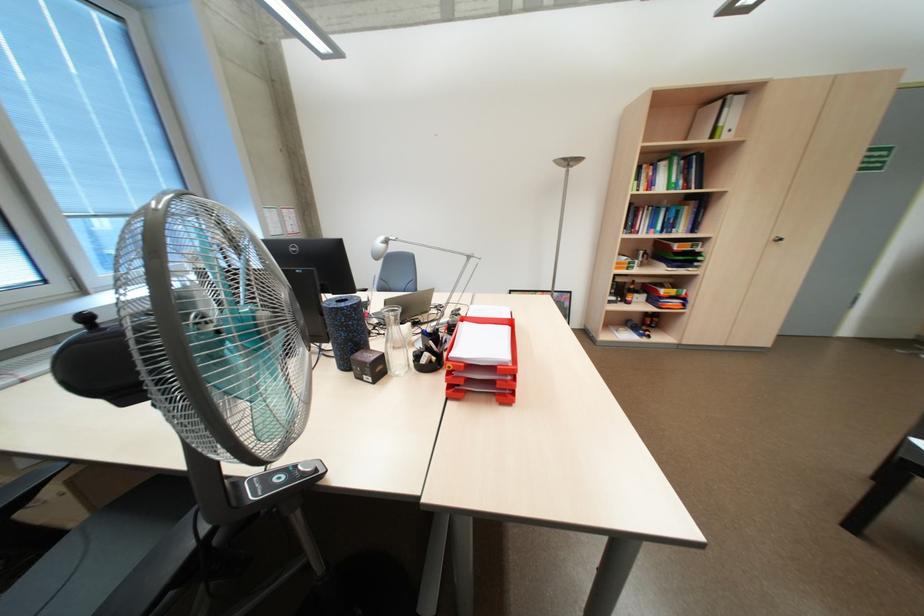
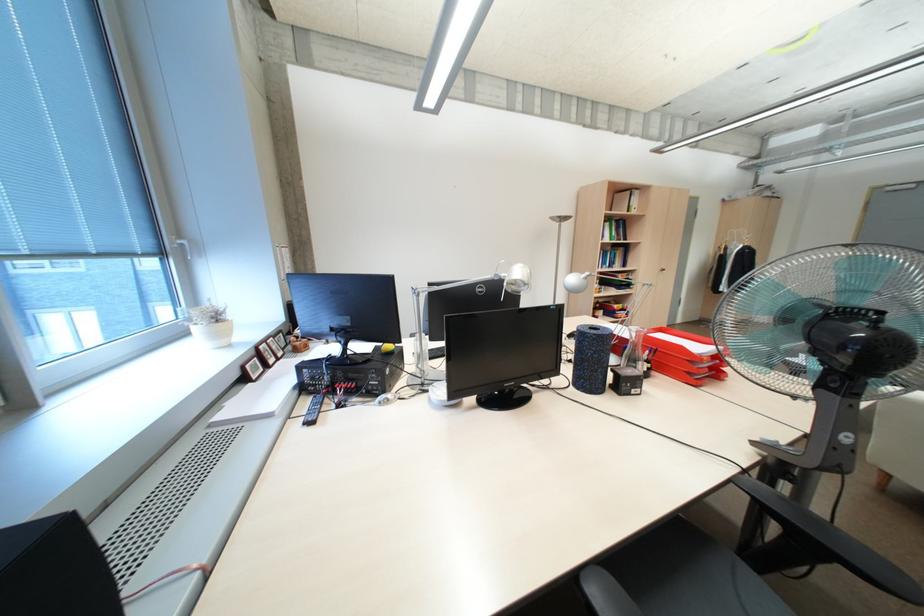
Find the pixel in the second image that matches point (662, 225) in the first image.

(614, 262)